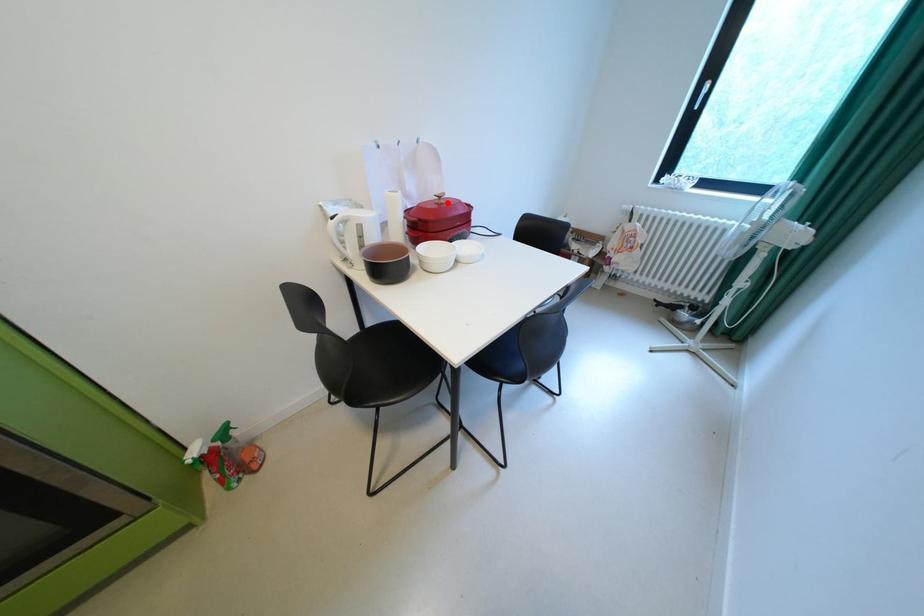
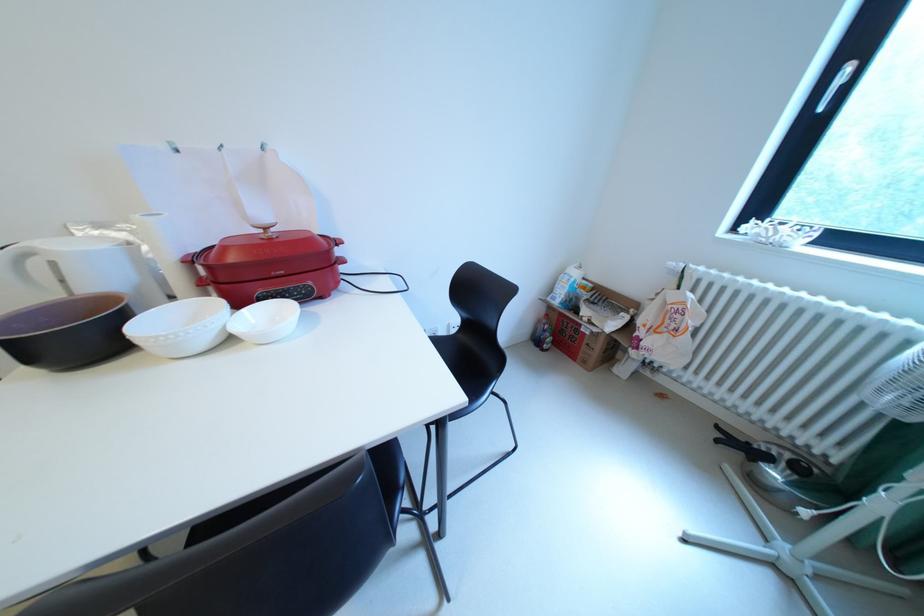
Find the pixel in the second image that matches the highlighted location in the first image.

(273, 237)